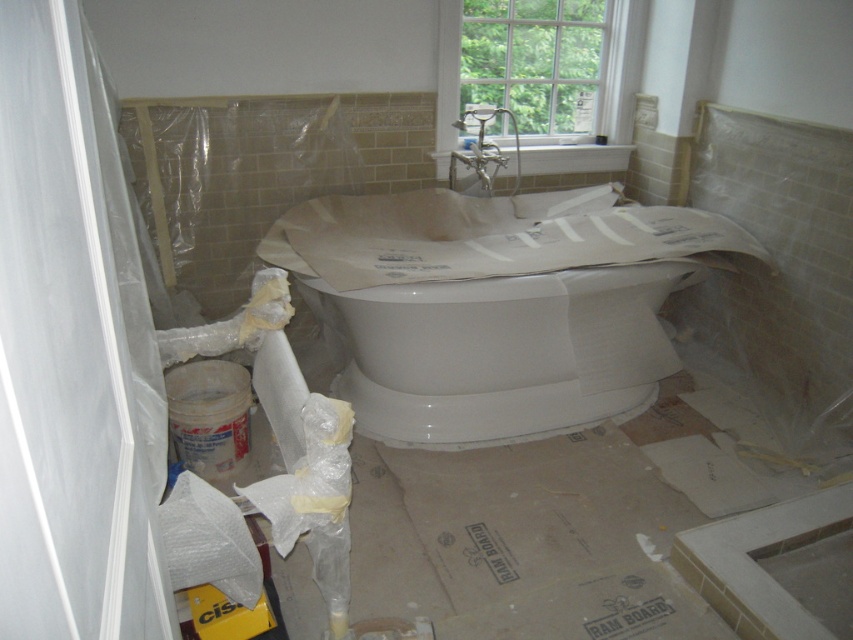
Question: Which point is farther to the camera?

Choices:
 (A) clear glass window at upper center
 (B) white glossy bathtub at center

Answer: (A)

Question: Does white glossy bathtub at center appear on the right side of clear glass window at upper center?

Choices:
 (A) no
 (B) yes

Answer: (A)

Question: Is white glossy bathtub at center wider than clear glass window at upper center?

Choices:
 (A) no
 (B) yes

Answer: (B)

Question: Does white glossy bathtub at center appear over clear glass window at upper center?

Choices:
 (A) no
 (B) yes

Answer: (A)

Question: Among these points, which one is nearest to the camera?

Choices:
 (A) (671, 372)
 (B) (473, 58)

Answer: (A)